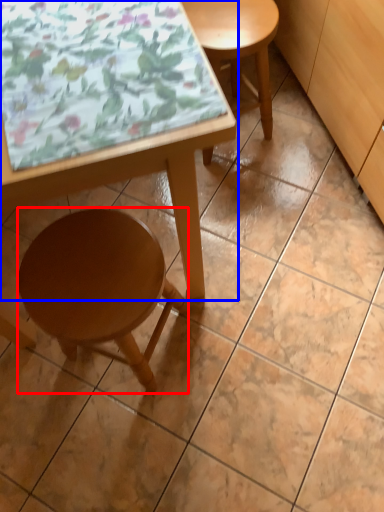
Question: Which of the following is the farthest to the observer, stool (highlighted by a red box) or table (highlighted by a blue box)?

Choices:
 (A) stool
 (B) table

Answer: (A)